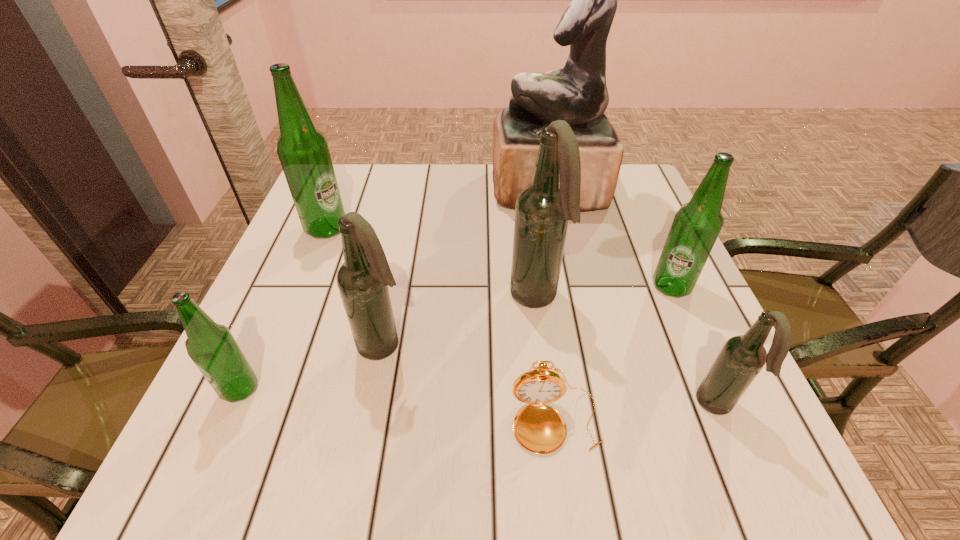
Locate an element on the screen. the tallest object is located at coordinates (577, 94).

Image resolution: width=960 pixels, height=540 pixels. I want to click on the biggest green beer bottle, so click(303, 151).

This screenshot has width=960, height=540. What are the coordinates of `the farthest green beer bottle` in the screenshot? It's located at (303, 151).

Locate an element on the screen. The height and width of the screenshot is (540, 960). the farthest dark beer bottle is located at coordinates (543, 209).

This screenshot has width=960, height=540. I want to click on the fourth beer bottle from left to right, so click(x=543, y=209).

Where is `the leftmost dark beer bottle`? This screenshot has width=960, height=540. the leftmost dark beer bottle is located at coordinates (363, 279).

Locate an element on the screen. Image resolution: width=960 pixels, height=540 pixels. the second biggest dark beer bottle is located at coordinates 363,279.

Locate an element on the screen. Image resolution: width=960 pixels, height=540 pixels. the second biggest green beer bottle is located at coordinates (695, 228).

Where is `the second nearest green beer bottle`? The width and height of the screenshot is (960, 540). the second nearest green beer bottle is located at coordinates (695, 228).

The image size is (960, 540). I want to click on the nearest dark beer bottle, so click(x=742, y=357).